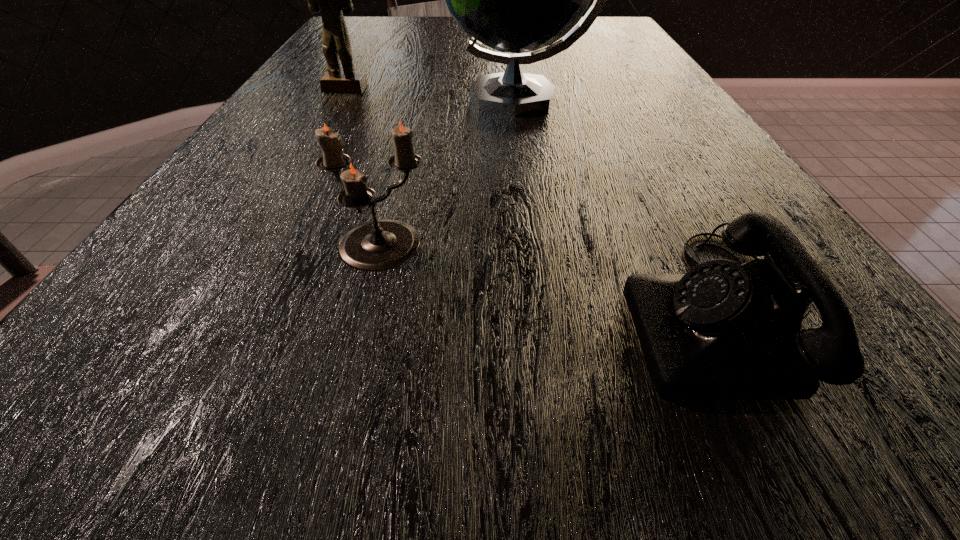
Find the location of a particular element. The image size is (960, 540). vacant space at the right edge of the desktop is located at coordinates (718, 176).

Find the location of a particular element. The height and width of the screenshot is (540, 960). vacant space at the far left corner is located at coordinates (346, 22).

This screenshot has width=960, height=540. In order to click on free space between the telephone and the tallest object in this screenshot , I will do `click(621, 205)`.

At what (x,y) coordinates should I click in order to perform the action: click on free spot between the shortest object and the third tallest object. Please return your answer as a coordinate pair (x, y). Looking at the image, I should click on (551, 280).

Identify the location of vacant area between the shortest object and the candle holder. (551, 280).

The height and width of the screenshot is (540, 960). I want to click on free spot between the globe and the third tallest object, so click(x=448, y=173).

I want to click on free space between the shortest object and the second tallest object, so click(535, 201).

At what (x,y) coordinates should I click in order to perform the action: click on empty space between the globe and the telephone. Please return your answer as a coordinate pair (x, y). The width and height of the screenshot is (960, 540). Looking at the image, I should click on (621, 205).

Locate an element on the screen. This screenshot has height=540, width=960. vacant area that lies between the globe and the shortest object is located at coordinates (621, 205).

You are a GUI agent. You are given a task and a screenshot of the screen. Output one action in this format:
    pyautogui.click(x=<x>, y=<y>)
    Task: Click on the free space between the tallest object and the telephone
    
    Given the screenshot: What is the action you would take?
    pyautogui.click(x=621, y=205)